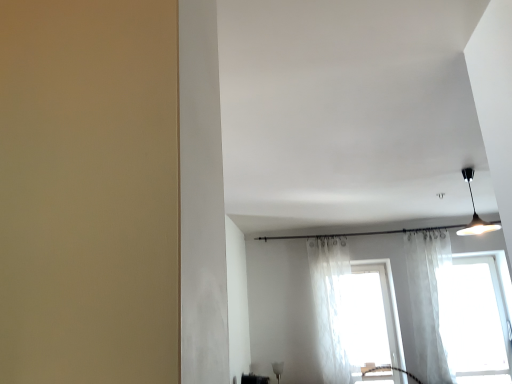
Question: Is translucent fabric window at center, arranged as the second window when viewed from the right, taller or shorter than transparent fabric window at right, the 2th window from the left?

Choices:
 (A) tall
 (B) short

Answer: (B)

Question: From a real-world perspective, is translucent fabric window at center, placed as the 1th window when sorted from left to right, physically located above or below transparent fabric window at right, arranged as the first window when viewed from the right?

Choices:
 (A) above
 (B) below

Answer: (A)

Question: Estimate the real-world distances between objects in this image. Which object is closer to the black glossy shelf at lower center?

Choices:
 (A) translucent white curtain at center, the second curtain positioned from the right
 (B) black matte pendant light at upper right
 (C) translucent fabric window at center, arranged as the second window when viewed from the right
 (D) white sheer curtain at right, which ranks as the 2th curtain in left-to-right order
 (E) transparent fabric window at right, arranged as the first window when viewed from the right

Answer: (A)

Question: Based on their relative distances, which object is nearer to the translucent fabric window at center, placed as the 1th window when sorted from left to right?

Choices:
 (A) black matte pendant light at upper right
 (B) translucent white curtain at center, the second curtain positioned from the right
 (C) black glossy shelf at lower center
 (D) white sheer curtain at right, the 1th curtain when ordered from right to left
 (E) transparent fabric window at right, arranged as the first window when viewed from the right

Answer: (B)